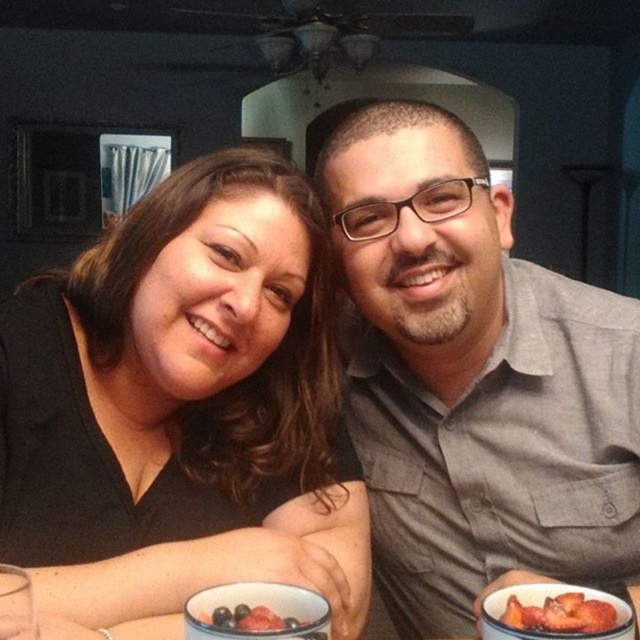
Question: Is smooth red strawberries at lower right below blueberry matte at lower center?

Choices:
 (A) no
 (B) yes

Answer: (B)

Question: Can you confirm if black matte shirt at center is thinner than smooth red strawberries at lower right?

Choices:
 (A) yes
 (B) no

Answer: (B)

Question: Among these objects, which one is nearest to the camera?

Choices:
 (A) blueberry matte at lower center
 (B) gray cotton shirt at center
 (C) smooth red strawberries at lower right

Answer: (A)

Question: In this image, where is black matte shirt at center located relative to blueberry matte at lower center?

Choices:
 (A) right
 (B) left

Answer: (B)

Question: Which point is closer to the camera?

Choices:
 (A) (538, 628)
 (B) (282, 621)
 (C) (108, 564)
 (D) (589, 500)

Answer: (A)

Question: Considering the real-world distances, which object is closest to the smooth red strawberries at lower right?

Choices:
 (A) gray cotton shirt at center
 (B) black matte shirt at center
 (C) blueberry matte at lower center

Answer: (C)